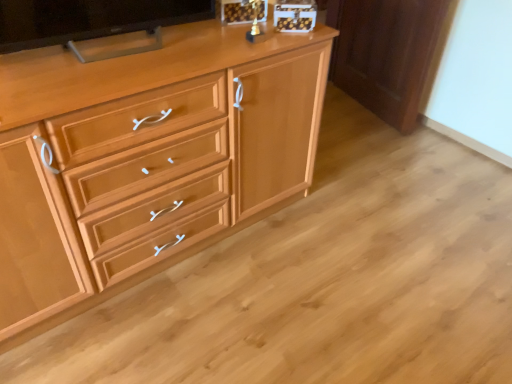
Find the location of a particular element. free spot above light wood cabinet at center (from a real-world perspective) is located at coordinates (133, 54).